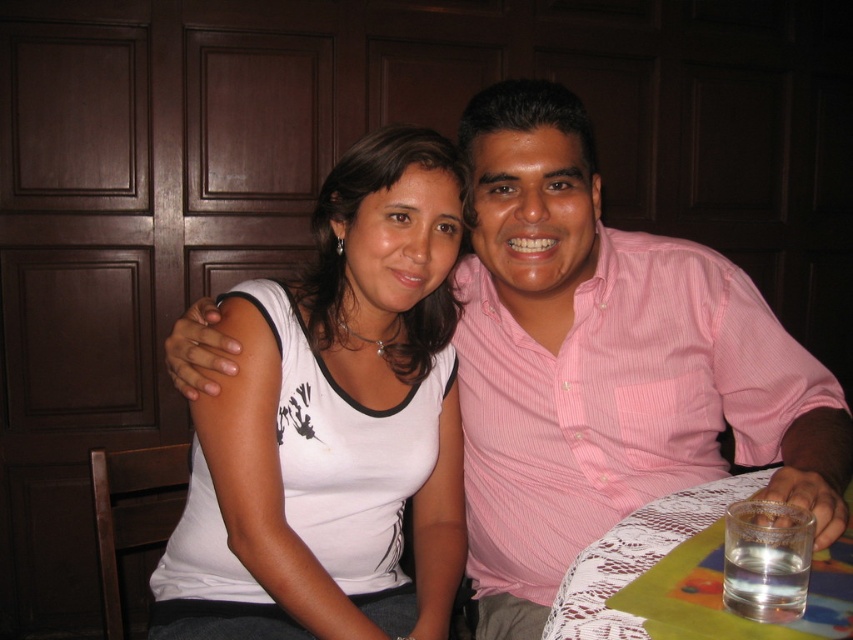
You are a photographer taking a photo of the scene. You want to ensure the lace fabric tablecloth at lower right is visible in the background behind the pink striped shirt at center. Is the current arrangement suitable for this?

Yes, the current arrangement is suitable because the lace fabric tablecloth at lower right is already positioned behind the pink striped shirt at center, allowing it to be visible in the background.

You are a photographer trying to capture a candid shot of two people sitting at a table. You notice the pink striped shirt at center and the pink striped shirt at right. Which shirt is located to the left of the other?

The pink striped shirt at right is located to the left of the pink striped shirt at center because the pink striped shirt at center is positioned on the right side of the pink striped shirt at right.